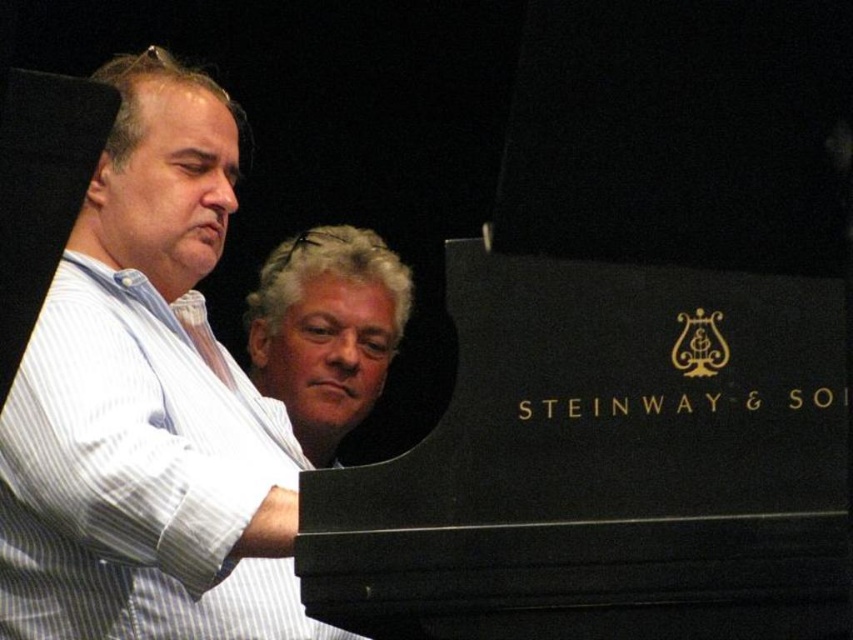
You are a photographer setting up for a portrait shoot. You need to position your camera so that both the black polished wood piano at center and the gray hair at center are clearly visible in the frame. Based on their positions, which object should you focus on first to ensure both are in focus?

The black polished wood piano at center is below gray hair at center, so you should focus on the black polished wood piano at center first to ensure both are in focus.